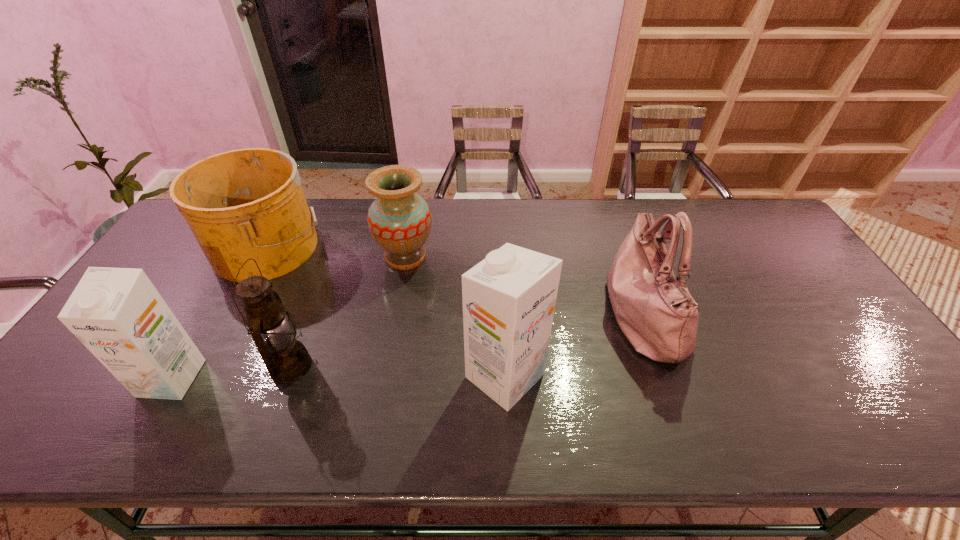
You are a GUI agent. You are given a task and a screenshot of the screen. Output one action in this format:
    pyautogui.click(x=<x>, y=<y>)
    Task: Click on the left carton
    The image size is (960, 540).
    Given the screenshot: What is the action you would take?
    pyautogui.click(x=118, y=315)

Identify the location of the taller carton. Image resolution: width=960 pixels, height=540 pixels. (509, 298).

Identify the location of the second object from right to left. This screenshot has width=960, height=540. (509, 298).

Locate an element on the screen. This screenshot has width=960, height=540. vase is located at coordinates (399, 220).

Identify the location of handbag. Image resolution: width=960 pixels, height=540 pixels. [x=655, y=311].

Locate an element on the screen. The width and height of the screenshot is (960, 540). bucket is located at coordinates (247, 203).

Identify the location of oil lamp. (286, 359).

Image resolution: width=960 pixels, height=540 pixels. I want to click on free space located on the back of the shorter carton, so [x=243, y=258].

I want to click on vacant space located 0.310m on the left of the fifth object from left to right, so click(337, 376).

I want to click on free region located 0.130m on the left of the vase, so click(334, 256).